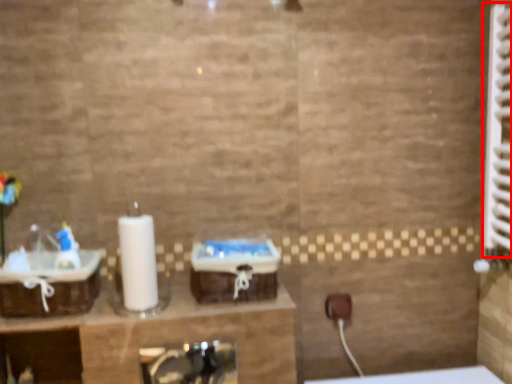
Question: From the image's perspective, what is the correct spatial relationship of radiator (annotated by the red box) in relation to sink?

Choices:
 (A) above
 (B) below

Answer: (A)